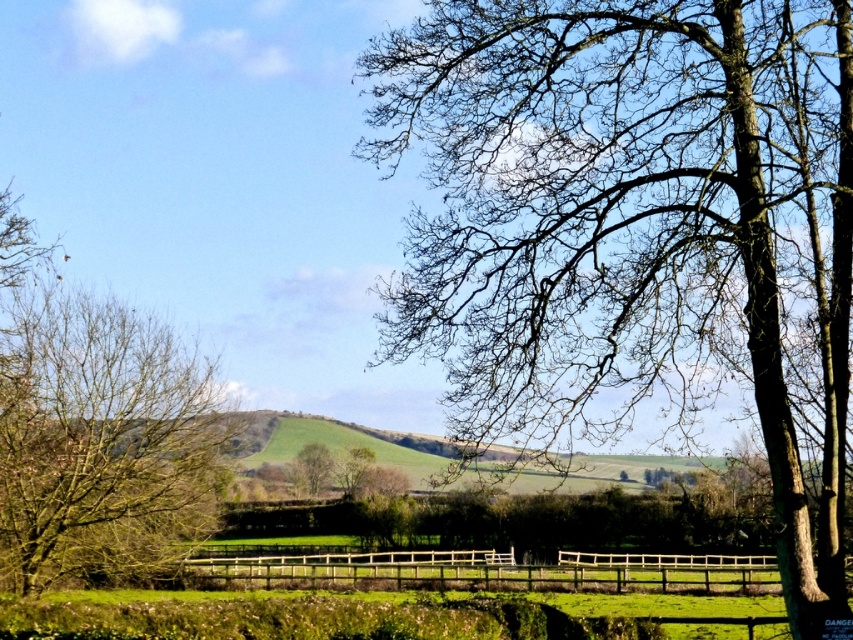
You are an artist setting up an easel to paint the scene. You want to ensure that the bare branches at upper right and the wooden fence at center are both visible in your painting. Given their relative heights, which object should you position closer to the top of your canvas?

The bare branches at upper right should be positioned closer to the top of the canvas because they are taller than the wooden fence at center.

You are a painter standing in the middle of the field. You want to paint the wooden fence at center and the green matte tree at center. How far apart are these two objects from each other?

The wooden fence at center and the green matte tree at center are 3.71 meters apart.

You are an artist sketching this scene and want to place a small bird on the bare branches at upper right and a butterfly near the wooden fence at center. Based on their positions, which creature would be closer to the center of the image?

The butterfly near the wooden fence at center would be closer to the center of the image because the wooden fence at center is positioned at the center, while the bare branches at upper right are on its right side.